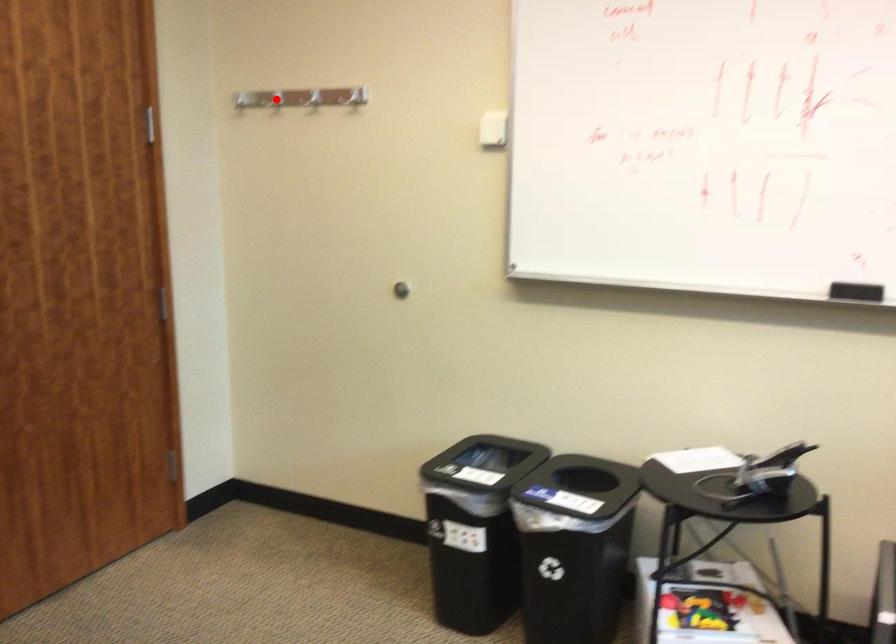
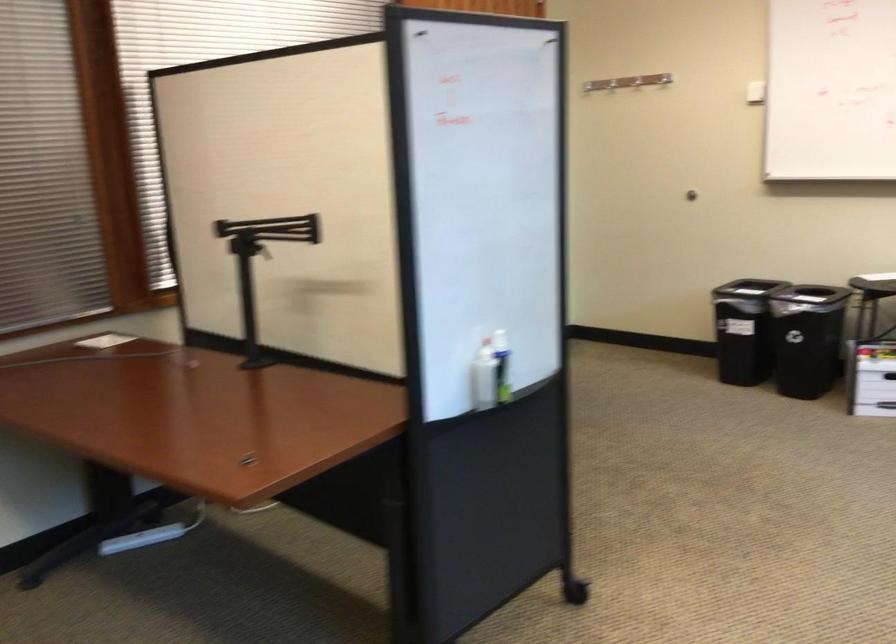
Question: I am providing you with two images of the same scene from different viewpoints. A red point is marked on the first image. Is the red point's position out of view in image 2?

Choices:
 (A) Yes
 (B) No

Answer: (A)